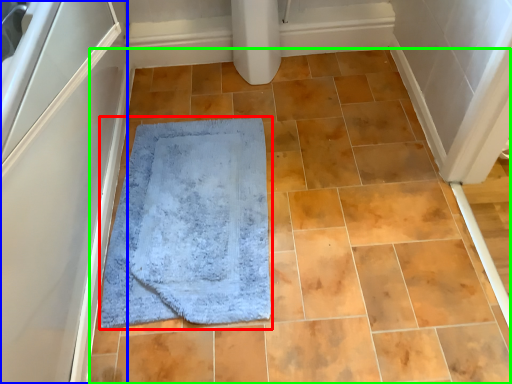
Question: Which is nearer to the bath mat (highlighted by a red box)? screen door (highlighted by a blue box) or ceramic tile (highlighted by a green box).

Choices:
 (A) screen door
 (B) ceramic tile

Answer: (B)